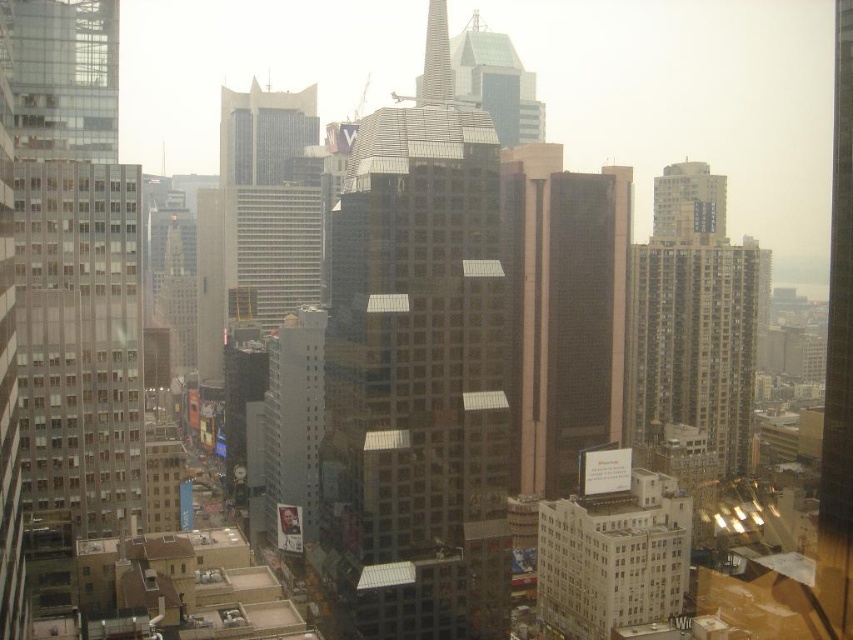
Who is more forward, (91, 264) or (621, 468)?

Point (91, 264) is in front.

Is transparent glass skyscraper at left taller than white concrete billboard at lower right?

Yes, transparent glass skyscraper at left is taller than white concrete billboard at lower right.

Is point (90, 138) behind point (614, 499)?

No.

Where is `transparent glass skyscraper at left`? transparent glass skyscraper at left is located at coordinates (70, 268).

Can you confirm if glossy glass skyscraper at center is taller than white smooth building at center?

Indeed, glossy glass skyscraper at center has a greater height compared to white smooth building at center.

Consider the image. Is glossy glass skyscraper at center smaller than white smooth building at center?

No, glossy glass skyscraper at center is not smaller than white smooth building at center.

The width and height of the screenshot is (853, 640). Identify the location of glossy glass skyscraper at center. (418, 371).

Can you confirm if white concrete billboard at lower right is wider than white smooth building at center?

Indeed, white concrete billboard at lower right has a greater width compared to white smooth building at center.

Which is in front, point (579, 618) or point (312, 513)?

Positioned in front is point (579, 618).

Between point (601, 499) and point (288, 534), which one is positioned behind?

Point (288, 534)

Identify the location of white concrete billboard at lower right. (612, 548).